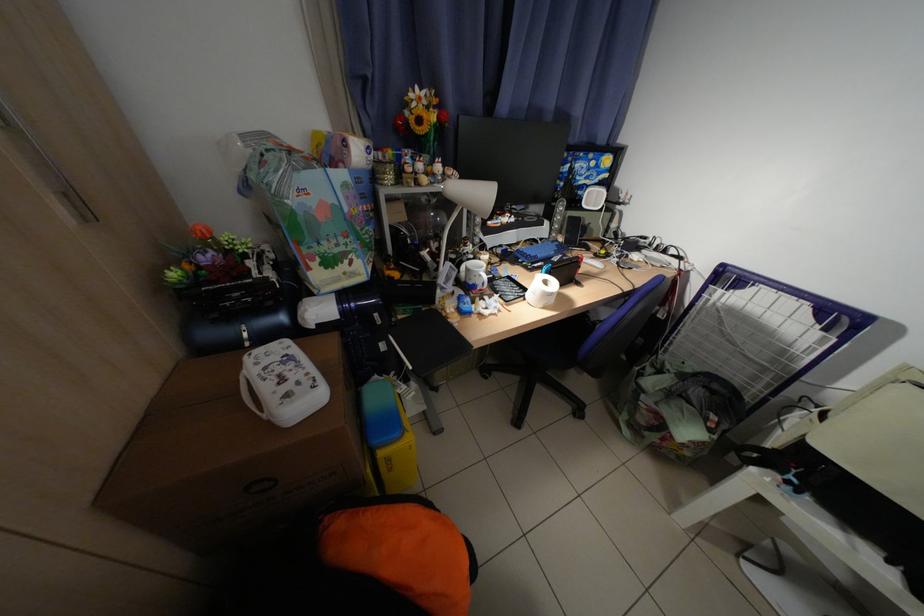
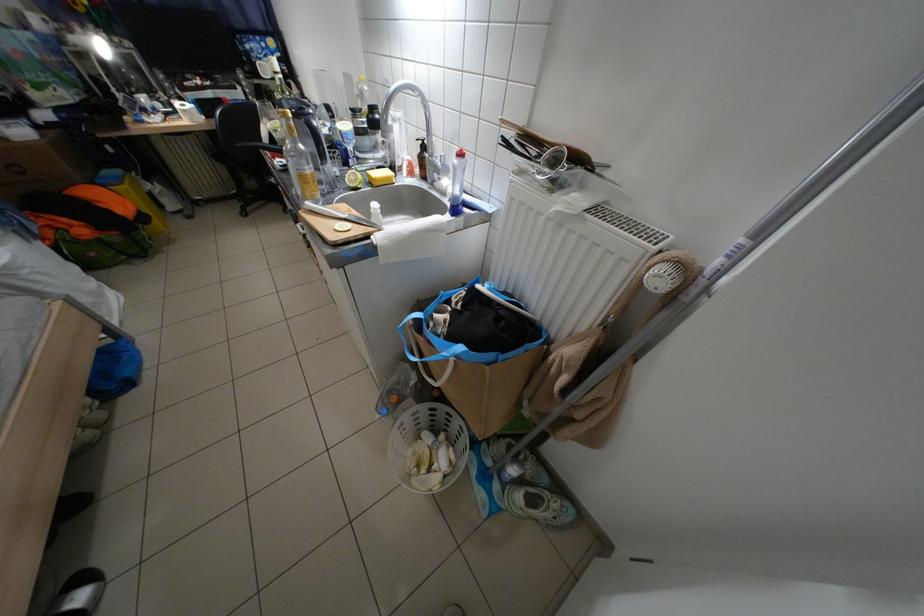
In a continuous first-person perspective shot, in which direction is the camera moving?

The cameraman walked toward right, backward.